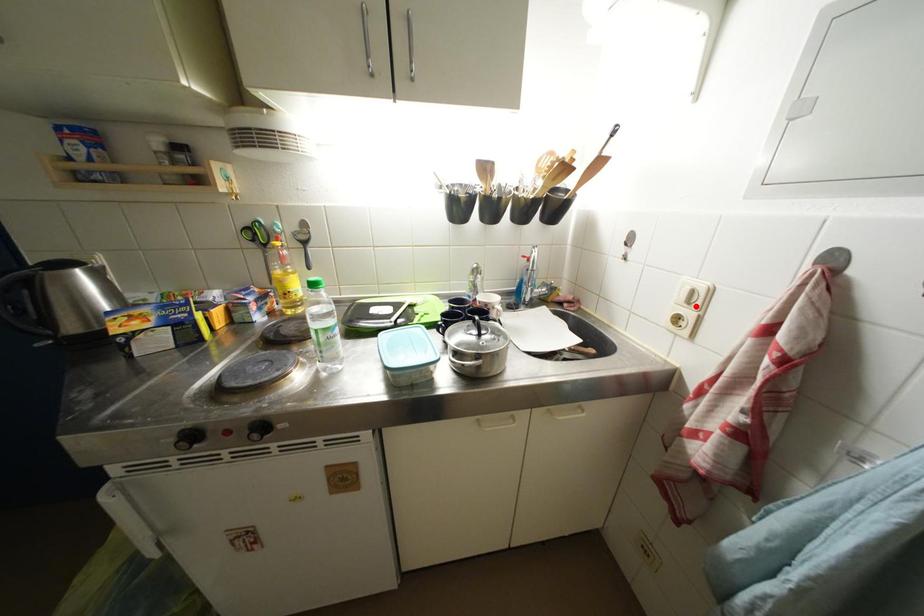
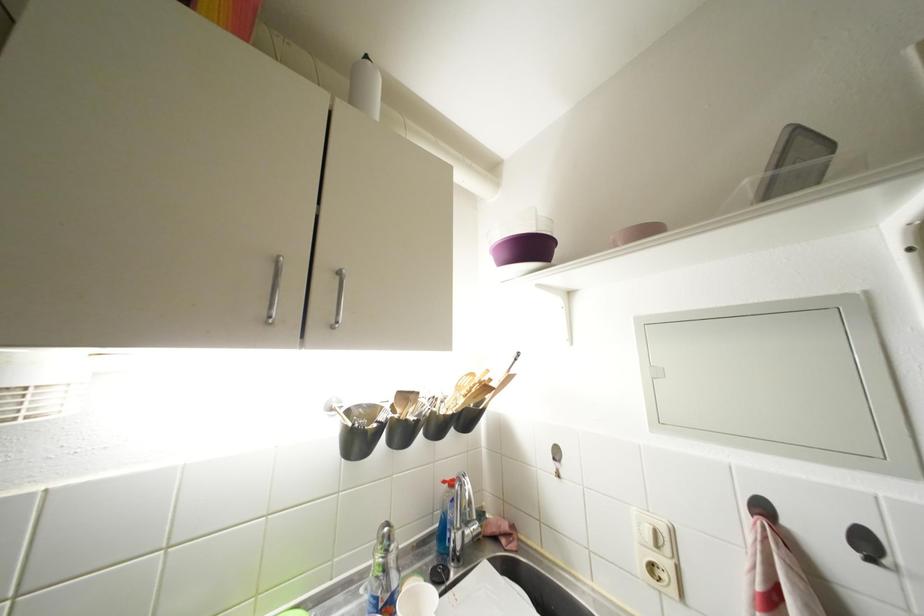
Locate, in the second image, the point that corresponds to the highlighted location in the first image.

(663, 549)